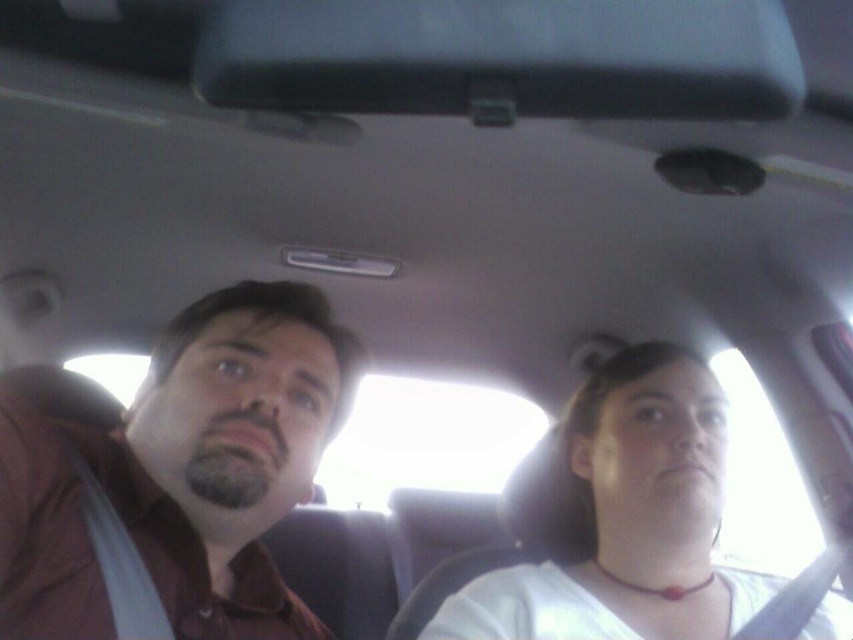
Question: Does brown matte shirt at left appear over white matte shirt at center?

Choices:
 (A) yes
 (B) no

Answer: (A)

Question: Considering the relative positions of brown matte shirt at left and white matte shirt at center in the image provided, where is brown matte shirt at left located with respect to white matte shirt at center?

Choices:
 (A) above
 (B) below

Answer: (A)

Question: Which object appears closest to the camera in this image?

Choices:
 (A) white matte shirt at center
 (B) brown matte shirt at left

Answer: (B)

Question: Is brown matte shirt at left to the left of white matte shirt at center from the viewer's perspective?

Choices:
 (A) yes
 (B) no

Answer: (A)